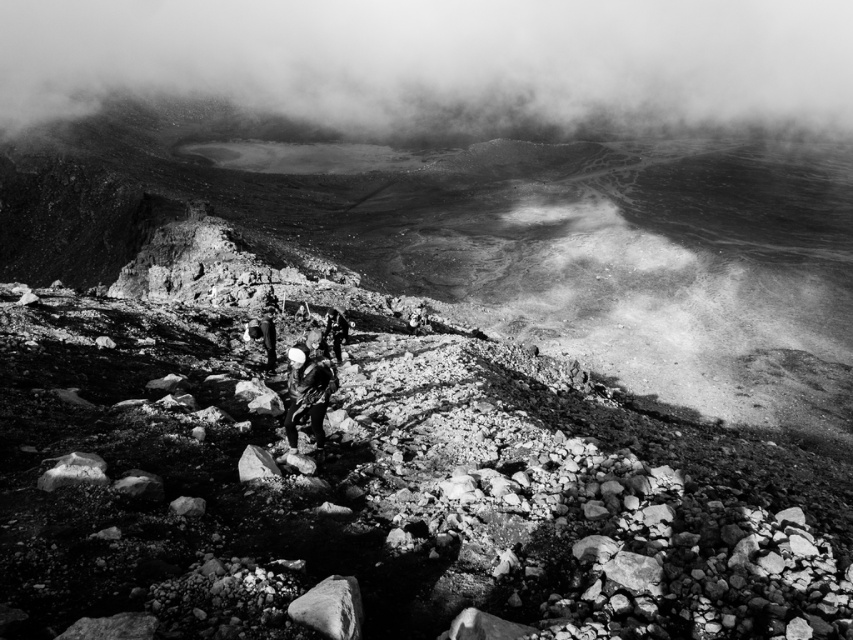
Question: Which point appears farthest from the camera in this image?

Choices:
 (A) (250, 476)
 (B) (73, 468)

Answer: (A)

Question: Which of the following is the farthest from the observer?

Choices:
 (A) dark gray fabric backpack at center
 (B) dark fabric jacket at center
 (C) smooth gray rock at center

Answer: (B)

Question: Which point is closer to the camera taking this photo?

Choices:
 (A) (328, 612)
 (B) (770, 16)

Answer: (A)

Question: From the image, what is the correct spatial relationship of dark gray fabric backpack at center in relation to smooth gray rock at lower center?

Choices:
 (A) below
 (B) above

Answer: (B)

Question: Does smooth gray rock at center have a larger size compared to dark fabric jacket at center?

Choices:
 (A) yes
 (B) no

Answer: (B)

Question: Is dark gray fabric backpack at center positioned in front of smooth gray rock at center?

Choices:
 (A) yes
 (B) no

Answer: (B)